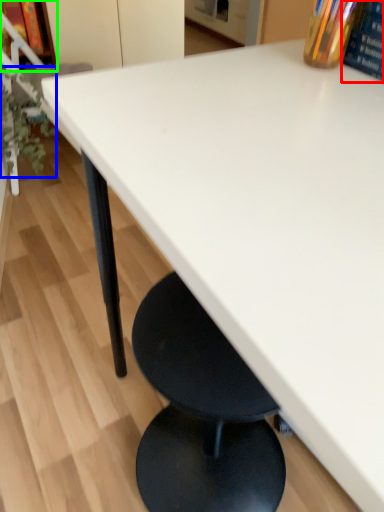
Question: Which object is positioned farthest from paperback book (highlighted by a red box)? Select from plant (highlighted by a blue box) and shelf (highlighted by a green box).

Choices:
 (A) plant
 (B) shelf

Answer: (B)